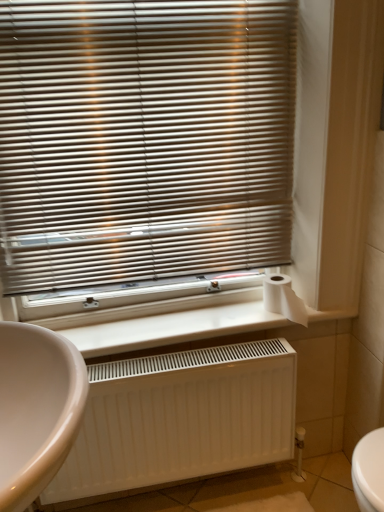
Identify the location of free space above white matte radiator at lower center (from a real-world perspective). (181, 359).